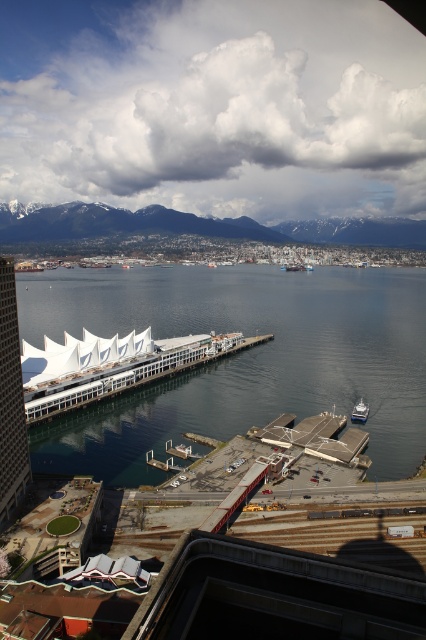
Is white matte dock at lower left closer to the viewer compared to metallic silver boat at lower right?

Yes, white matte dock at lower left is closer to the viewer.

Does white matte dock at lower left appear on the right side of metallic silver boat at lower right?

In fact, white matte dock at lower left is to the left of metallic silver boat at lower right.

Which is behind, point (25, 387) or point (363, 413)?

The point (363, 413) is behind.

The image size is (426, 640). I want to click on white matte dock at lower left, so click(117, 369).

Based on the photo, between snowy mountain range at upper center and metallic silver boat at lower right, which one appears on the right side from the viewer's perspective?

metallic silver boat at lower right

Describe the element at coordinates (199, 227) in the screenshot. I see `snowy mountain range at upper center` at that location.

Where is `snowy mountain range at upper center`? This screenshot has height=640, width=426. snowy mountain range at upper center is located at coordinates (199, 227).

Does point (60, 470) come closer to viewer compared to point (310, 227)?

That is True.

Image resolution: width=426 pixels, height=640 pixels. I want to click on clear blue water at center, so click(238, 358).

Where is `clear blue water at center`? The image size is (426, 640). clear blue water at center is located at coordinates (238, 358).

Locate an element on the screen. The height and width of the screenshot is (640, 426). clear blue water at center is located at coordinates (238, 358).